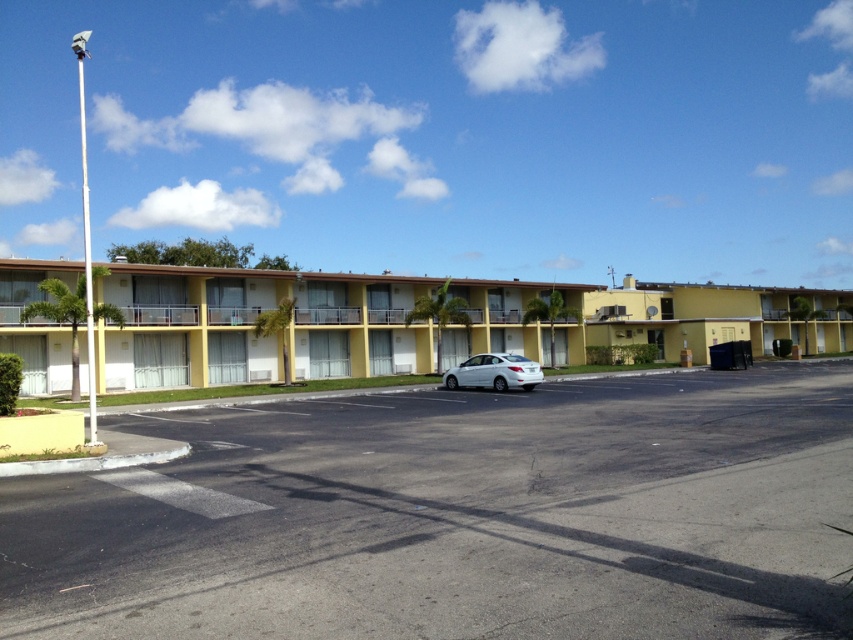
Question: Among these points, which one is nearest to the camera?

Choices:
 (A) (36, 604)
 (B) (370, 365)

Answer: (A)

Question: Based on their relative distances, which object is nearer to the yellow matte building at center?

Choices:
 (A) black asphalt parking lot at center
 (B) white glossy sedan at center

Answer: (B)

Question: Can you confirm if black asphalt parking lot at center is thinner than white glossy sedan at center?

Choices:
 (A) no
 (B) yes

Answer: (A)

Question: Is black asphalt parking lot at center below yellow matte building at center?

Choices:
 (A) no
 (B) yes

Answer: (B)

Question: Considering the real-world distances, which object is farthest from the black asphalt parking lot at center?

Choices:
 (A) yellow matte building at center
 (B) white glossy sedan at center

Answer: (A)

Question: Is the position of yellow matte building at center more distant than that of white glossy sedan at center?

Choices:
 (A) no
 (B) yes

Answer: (A)